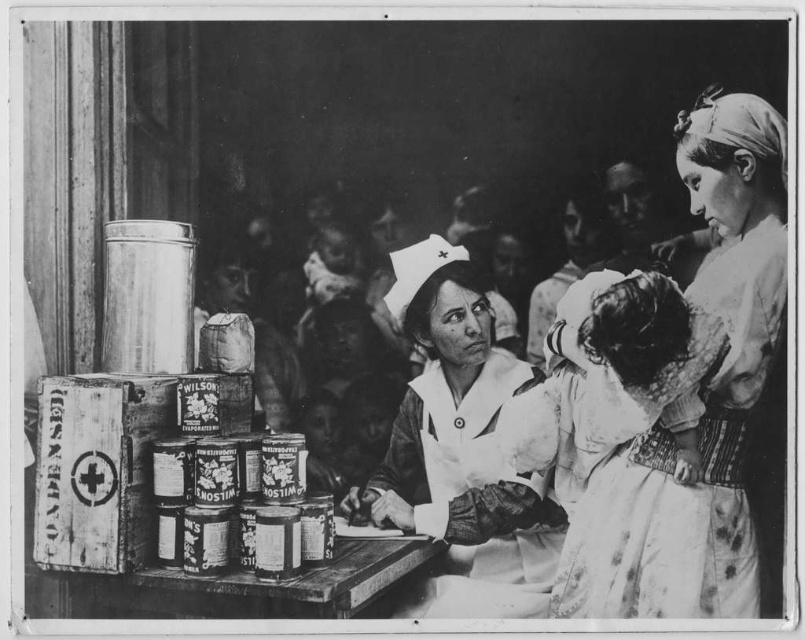
Question: Does white cotton dress at upper right appear under white cotton nurse uniform at center?

Choices:
 (A) yes
 (B) no

Answer: (B)

Question: In this image, where is white cotton dress at upper right located relative to white cotton nurse uniform at center?

Choices:
 (A) right
 (B) left

Answer: (A)

Question: Can you confirm if white cotton dress at upper right is bigger than white cotton nurse uniform at center?

Choices:
 (A) no
 (B) yes

Answer: (A)

Question: Which point is closer to the camera taking this photo?

Choices:
 (A) (515, 388)
 (B) (605, 593)

Answer: (B)

Question: Which of the following is the farthest from the observer?

Choices:
 (A) white cotton dress at upper right
 (B) white cotton nurse uniform at center

Answer: (B)